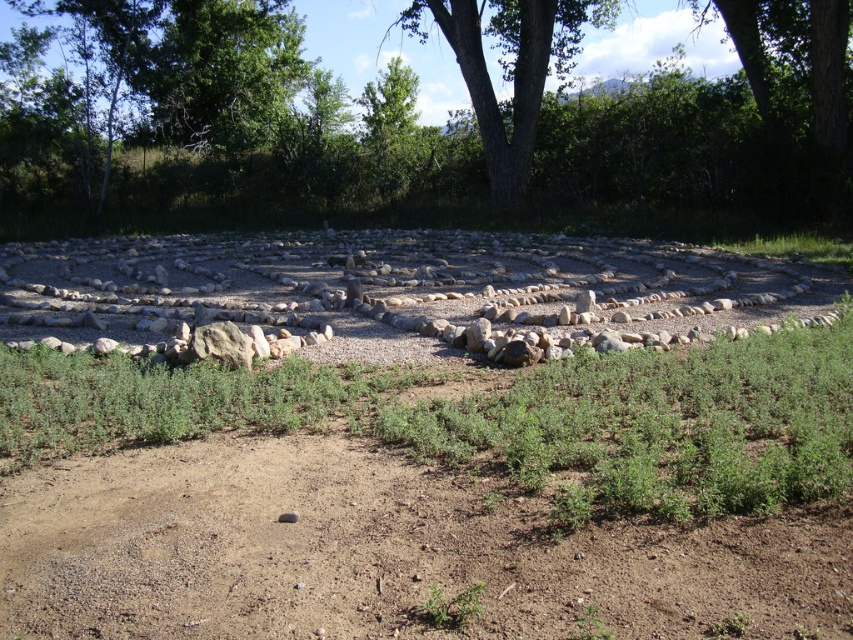
The width and height of the screenshot is (853, 640). What do you see at coordinates (418, 120) in the screenshot?
I see `green leafy tree at center` at bounding box center [418, 120].

This screenshot has width=853, height=640. What are the coordinates of `green leafy tree at center` in the screenshot? It's located at 418,120.

In order to click on green leafy tree at center in this screenshot , I will do `click(418, 120)`.